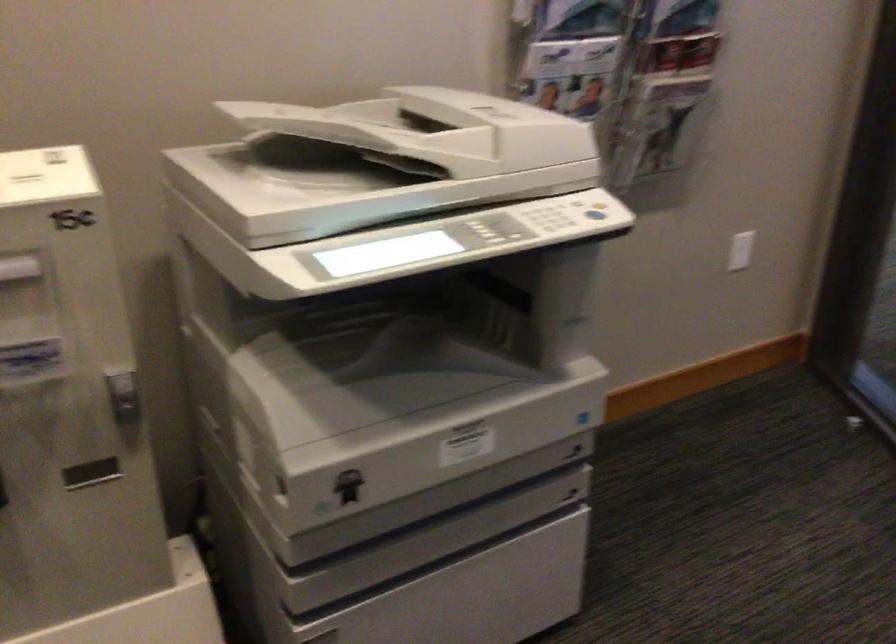
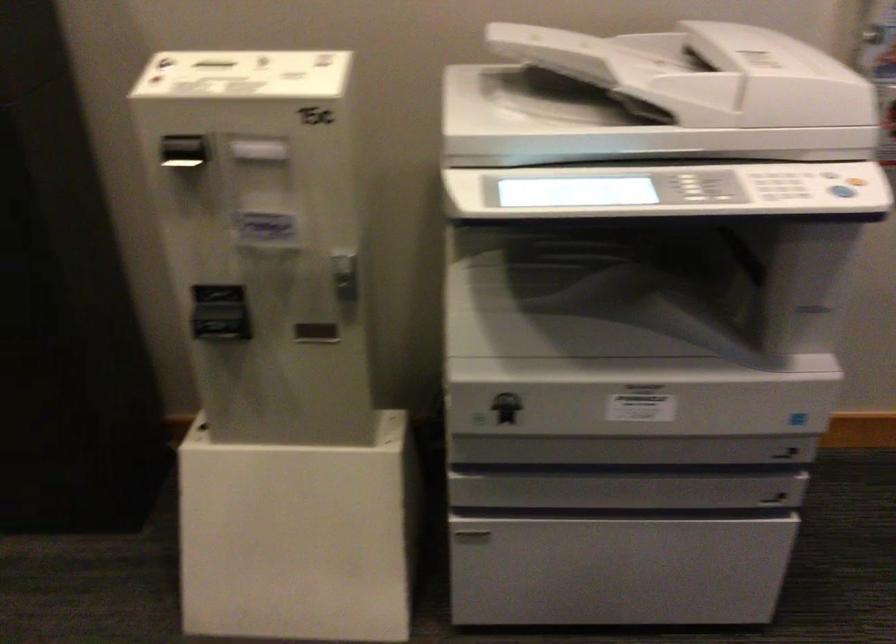
Locate, in the second image, the point that corresponds to the point at 576,488 in the first image.

(778, 493)